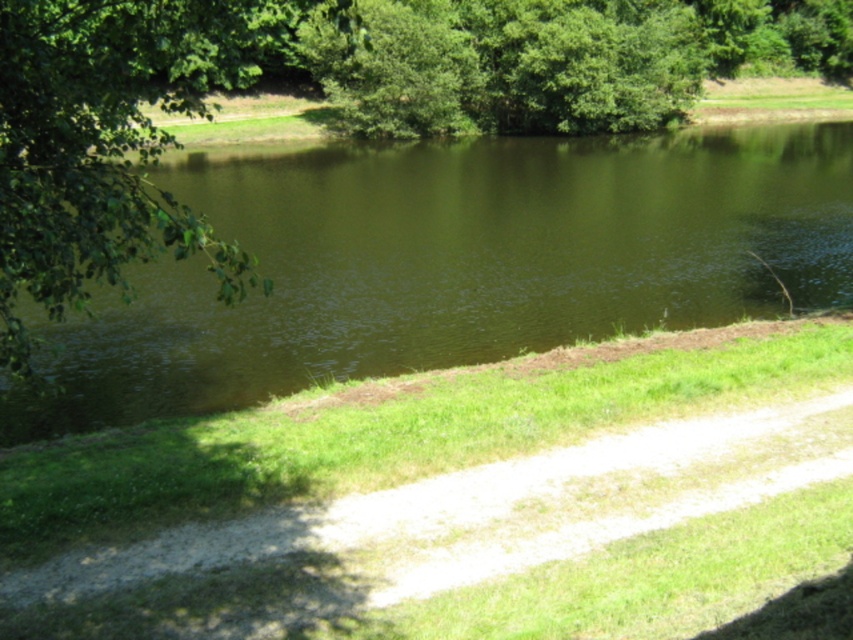
You are a hiker who needs to cross the green water at center. There is a green leafy tree at left nearby. Can you safely walk from the tree to the water if the average human stride is 2.5 feet?

The distance between the green water at center and the green leafy tree at left is 34.73 feet. Since each stride is 2.5 feet, you would need approximately 14 strides to cover the distance. This is feasible for a safe walk provided the terrain between them is passable.

You are standing at the point marked as point (576, 252) in the image. A friend is standing exactly where you are viewing this image from. How far apart are you from your friend in meters?

You and your friend are 91.44 feet apart from each other. Since 1 foot is approximately 0.3048 meters, converting this distance to meters would be 91.44 feet multiplied by 0.3048, which equals exactly 27.888 meters. Therefore, you and your friend are approximately 27.89 meters apart.